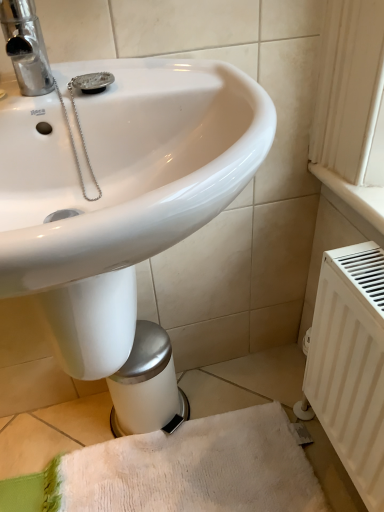
Question: Does white textured bath towel at lower center have a greater width compared to white matte radiator at right?

Choices:
 (A) no
 (B) yes

Answer: (B)

Question: From a real-world perspective, is white textured bath towel at lower center over white matte radiator at right?

Choices:
 (A) no
 (B) yes

Answer: (A)

Question: Is white textured bath towel at lower center oriented towards white matte radiator at right?

Choices:
 (A) no
 (B) yes

Answer: (A)

Question: Can white matte radiator at right be found inside white textured bath towel at lower center?

Choices:
 (A) no
 (B) yes

Answer: (A)

Question: Considering the relative sizes of white textured bath towel at lower center and white matte radiator at right in the image provided, is white textured bath towel at lower center shorter than white matte radiator at right?

Choices:
 (A) no
 (B) yes

Answer: (B)

Question: Is white matte radiator at right at the back of white textured bath towel at lower center?

Choices:
 (A) no
 (B) yes

Answer: (B)

Question: From the image's perspective, is white matte radiator at right located beneath white textured bath towel at lower center?

Choices:
 (A) yes
 (B) no

Answer: (B)

Question: Considering the relative sizes of white matte radiator at right and white textured bath towel at lower center in the image provided, is white matte radiator at right taller than white textured bath towel at lower center?

Choices:
 (A) yes
 (B) no

Answer: (A)

Question: Is white matte radiator at right outside of white textured bath towel at lower center?

Choices:
 (A) yes
 (B) no

Answer: (A)

Question: Can you confirm if white matte radiator at right is positioned to the right of white textured bath towel at lower center?

Choices:
 (A) no
 (B) yes

Answer: (B)

Question: Is white matte radiator at right placed right next to white textured bath towel at lower center?

Choices:
 (A) yes
 (B) no

Answer: (B)

Question: From a real-world perspective, is white matte radiator at right physically above white textured bath towel at lower center?

Choices:
 (A) no
 (B) yes

Answer: (B)

Question: Is white textured bath towel at lower center to the left or to the right of white matte radiator at right in the image?

Choices:
 (A) right
 (B) left

Answer: (B)